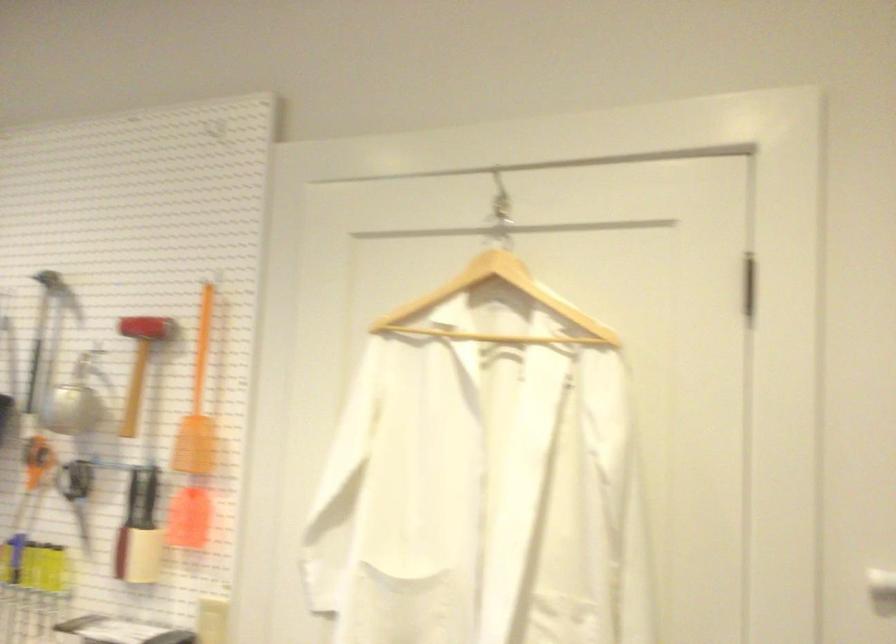
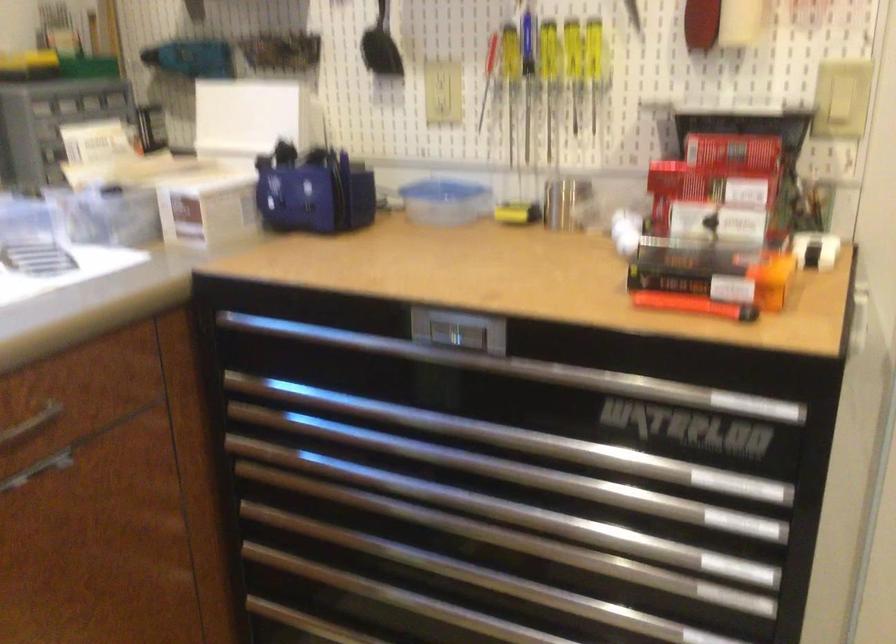
Question: The images are taken continuously from a first-person perspective. In which direction are you moving?

Choices:
 (A) Left
 (B) Right
 (C) Forward
 (D) Backward

Answer: (A)